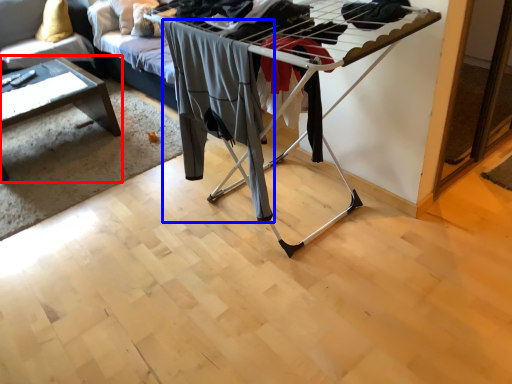
Question: Which object appears closest to the camera in this image, table (highlighted by a red box) or clothing (highlighted by a blue box)?

Choices:
 (A) table
 (B) clothing

Answer: (B)